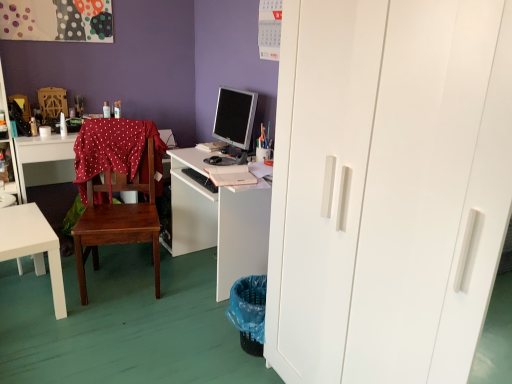
Question: Can you see wooden desk at left, acting as the 2th desk starting from the left, touching red polka dot fabric at center?

Choices:
 (A) no
 (B) yes

Answer: (A)

Question: Can you confirm if wooden desk at left, positioned as the second desk in right-to-left order, is wider than red polka dot fabric at center?

Choices:
 (A) no
 (B) yes

Answer: (B)

Question: Can you confirm if wooden desk at left, positioned as the second desk in right-to-left order, is taller than red polka dot fabric at center?

Choices:
 (A) yes
 (B) no

Answer: (A)

Question: From a real-world perspective, is wooden desk at left, acting as the 2th desk starting from the left, on top of red polka dot fabric at center?

Choices:
 (A) yes
 (B) no

Answer: (B)

Question: From the image's perspective, is wooden desk at left, acting as the 2th desk starting from the left, on red polka dot fabric at center?

Choices:
 (A) yes
 (B) no

Answer: (B)

Question: Considering the relative positions of wooden desk at left, acting as the 2th desk starting from the left, and red polka dot fabric at center in the image provided, is wooden desk at left, acting as the 2th desk starting from the left, to the right of red polka dot fabric at center from the viewer's perspective?

Choices:
 (A) no
 (B) yes

Answer: (A)

Question: Is silver metallic monitor at center surrounded by wooden desk at left, acting as the 2th desk starting from the left?

Choices:
 (A) no
 (B) yes

Answer: (A)

Question: Is wooden desk at left, positioned as the second desk in right-to-left order, outside silver metallic monitor at center?

Choices:
 (A) no
 (B) yes

Answer: (B)

Question: Does wooden desk at left, positioned as the second desk in right-to-left order, touch silver metallic monitor at center?

Choices:
 (A) yes
 (B) no

Answer: (B)

Question: Is wooden desk at left, positioned as the second desk in right-to-left order, facing away from silver metallic monitor at center?

Choices:
 (A) yes
 (B) no

Answer: (B)

Question: Considering the relative positions of wooden desk at left, acting as the 2th desk starting from the left, and silver metallic monitor at center in the image provided, is wooden desk at left, acting as the 2th desk starting from the left, behind silver metallic monitor at center?

Choices:
 (A) no
 (B) yes

Answer: (B)

Question: Is wooden desk at left, acting as the 2th desk starting from the left, closer to camera compared to silver metallic monitor at center?

Choices:
 (A) yes
 (B) no

Answer: (B)

Question: From a real-world perspective, is white matte desk at center, the first desk when ordered from right to left, over silver metallic monitor at center?

Choices:
 (A) no
 (B) yes

Answer: (A)